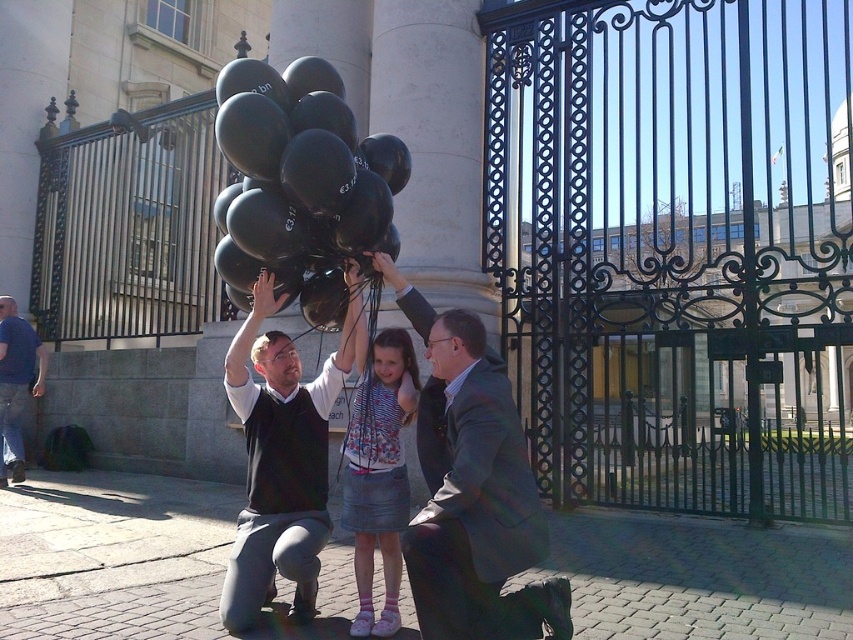
Does blue denim jeans at left appear under matte black hair at center?

Correct, blue denim jeans at left is located below matte black hair at center.

Which is in front, point (39, 346) or point (399, 342)?

Point (399, 342) is in front.

Where is `blue denim jeans at left`? The image size is (853, 640). blue denim jeans at left is located at coordinates (16, 384).

Based on the photo, does matte black sweater at center appear on the right side of matte black hair at center?

In fact, matte black sweater at center is to the left of matte black hair at center.

Consider the image. Does matte black sweater at center lie behind matte black hair at center?

No, matte black sweater at center is closer to the viewer.

Image resolution: width=853 pixels, height=640 pixels. In order to click on matte black sweater at center in this screenshot , I will do `click(280, 458)`.

Does point (349, 525) come closer to viewer compared to point (0, 312)?

That is True.

Who is taller, denim skirt at center or matte black balloon at center?

denim skirt at center

Which is behind, point (410, 362) or point (9, 307)?

The point (9, 307) is more distant.

Identify the location of denim skirt at center. (376, 464).